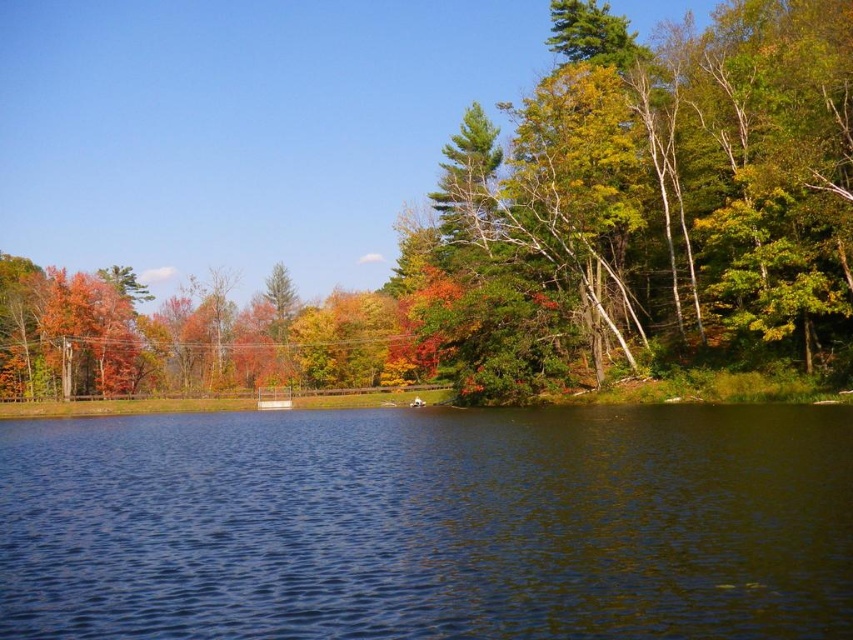
I want to click on autumn leaves at center, so click(x=543, y=236).